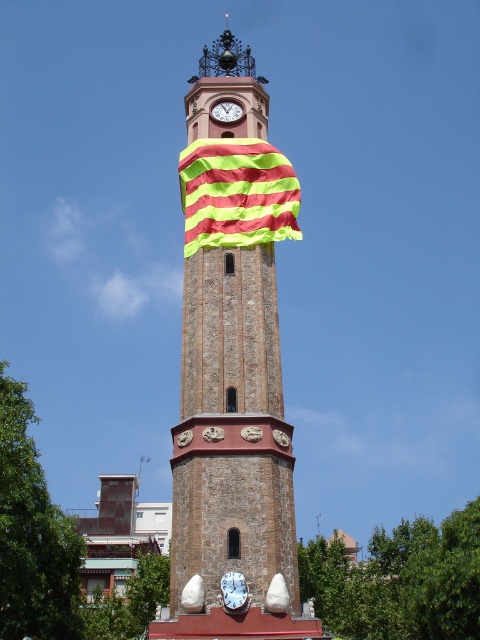
Does brown stone clock tower at center appear on the left side of matte red clock at center?

Correct, you'll find brown stone clock tower at center to the left of matte red clock at center.

Which is below, brown stone clock tower at center or matte red clock at center?

matte red clock at center

Is point (256, 284) in front of point (230, 115)?

Yes, it is in front of point (230, 115).

Locate an element on the screen. The width and height of the screenshot is (480, 640). brown stone clock tower at center is located at coordinates (232, 371).

In the scene shown: Which is more to the right, yellow-green striped cloth at center or matte red clock at center?

yellow-green striped cloth at center

Between yellow-green striped cloth at center and matte red clock at center, which one is positioned lower?

yellow-green striped cloth at center is lower down.

Is point (206, 177) farther from viewer compared to point (218, 116)?

That is False.

Where is `yellow-green striped cloth at center`? yellow-green striped cloth at center is located at coordinates (237, 193).

Consider the image. Can you confirm if white glossy clock at center is shorter than matte red clock at center?

No, white glossy clock at center is not shorter than matte red clock at center.

Does white glossy clock at center have a greater height compared to matte red clock at center?

Correct, white glossy clock at center is much taller as matte red clock at center.

The width and height of the screenshot is (480, 640). What are the coordinates of `white glossy clock at center` in the screenshot? It's located at (233, 589).

At what (x,y) coordinates should I click in order to perform the action: click on white glossy clock at center. Please return your answer as a coordinate pair (x, y). The width and height of the screenshot is (480, 640). Looking at the image, I should click on (233, 589).